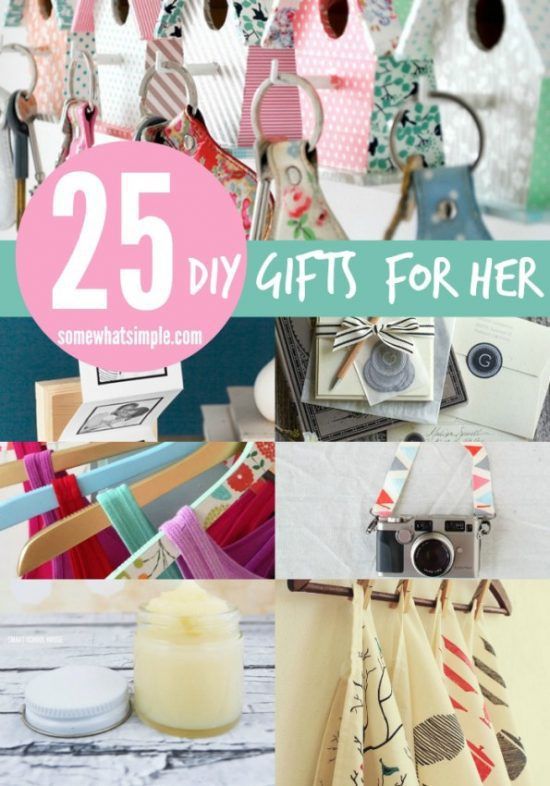
Find the location of `board`. board is located at coordinates (168, 736).